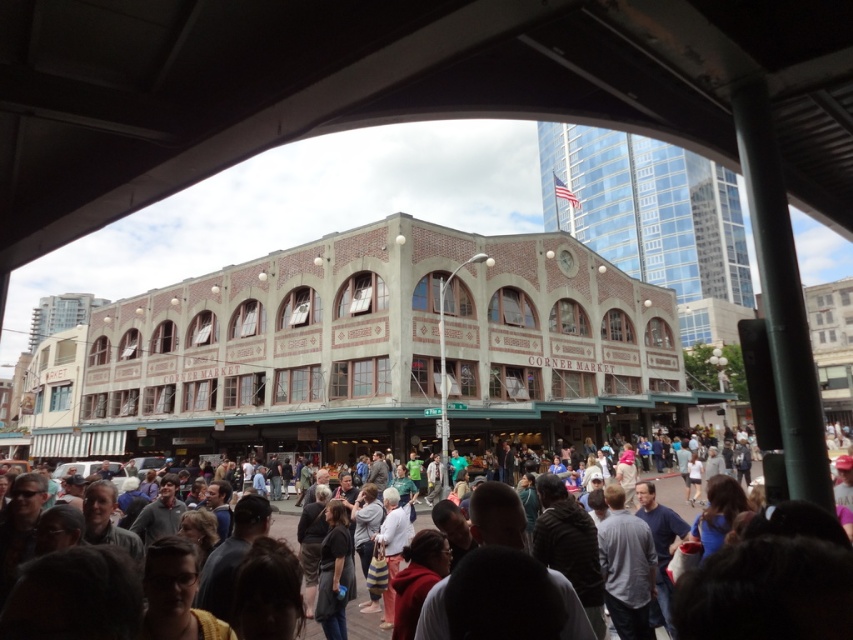
You are a delivery person with a 30 meter long rope. You need to secure the rope between the brick building at center and the dark gray clothing at lower center. Will the rope be sufficient?

The brick building at center and dark gray clothing at lower center are 28.92 meters apart from each other. Since the rope is 30 meters long, it will be sufficient to secure between them.

Based on the scene description, where is the brick building at center located in the image?

The brick building at center is located at point [374,353] in the image.

You are standing at the covered structure looking down at the scene. Can you see the dark gray clothing at lower center from the brick building at center?

The brick building at center is located above dark gray clothing at lower center, so yes, you can see the dark gray clothing at lower center from the brick building at center because it is positioned below it.